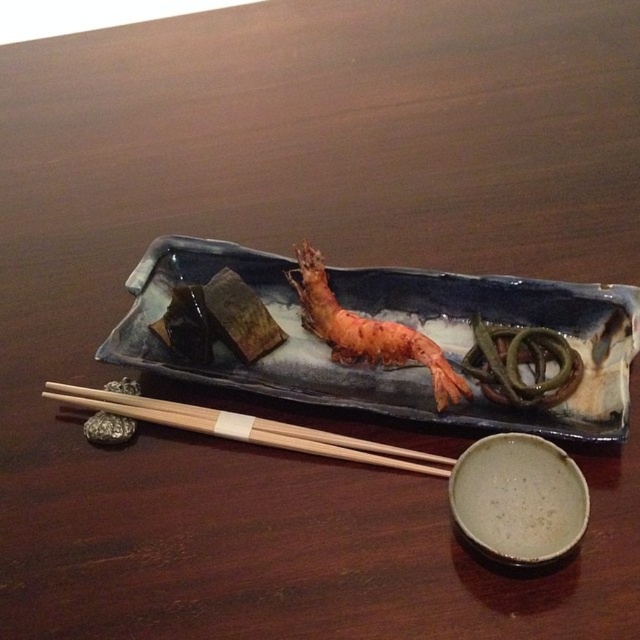
Question: Is blue ceramic tray at center below shiny orange shrimp at center?

Choices:
 (A) no
 (B) yes

Answer: (A)

Question: Which of the following is the farthest from the observer?

Choices:
 (A) wooden chopsticks at lower left
 (B) blue ceramic tray at center
 (C) shiny orange shrimp at center

Answer: (C)

Question: Which point is farther to the camera?

Choices:
 (A) (243, 435)
 (B) (284, 349)
 (C) (337, 360)

Answer: (B)

Question: From the image, what is the correct spatial relationship of blue ceramic tray at center in relation to wooden chopsticks at lower left?

Choices:
 (A) right
 (B) left

Answer: (A)

Question: Which object is closer to the camera taking this photo?

Choices:
 (A) blue ceramic tray at center
 (B) wooden chopsticks at lower left

Answer: (A)

Question: Is blue ceramic tray at center wider than wooden chopsticks at lower left?

Choices:
 (A) no
 (B) yes

Answer: (B)